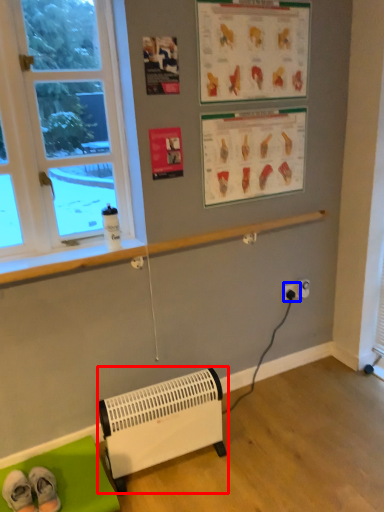
Question: Among these objects, which one is farthest to the camera, heater (highlighted by a red box) or electric outlet (highlighted by a blue box)?

Choices:
 (A) heater
 (B) electric outlet

Answer: (B)